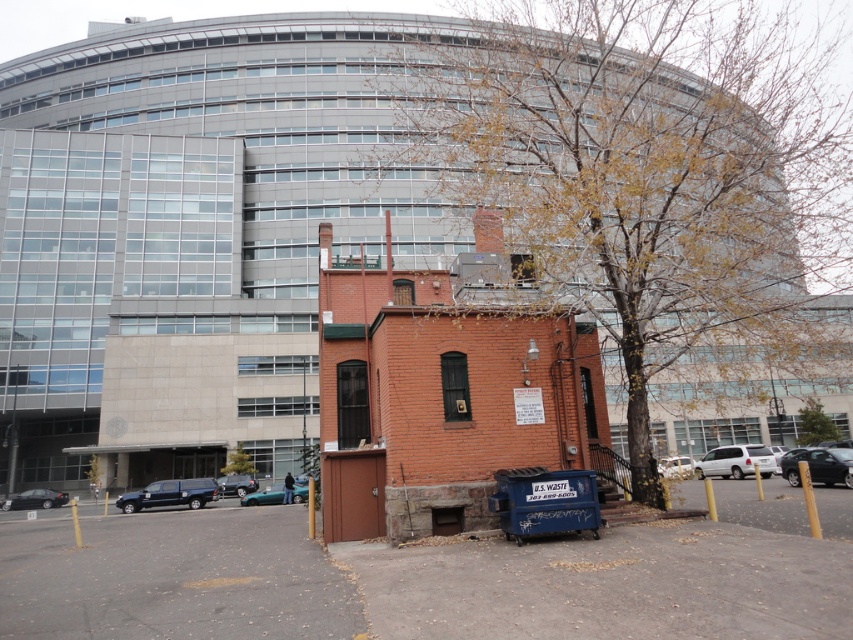
Question: Does white matte van at center lie behind shiny black sedan at center?

Choices:
 (A) yes
 (B) no

Answer: (B)

Question: Which object is the closest to the white matte van at center?

Choices:
 (A) silver metallic sedan at center
 (B) black metallic car at right
 (C) shiny black sedan at center
 (D) metallic blue truck at lower left

Answer: (A)

Question: Which object is positioned closest to the teal matte car at center?

Choices:
 (A) white matte van at center
 (B) metallic blue truck at lower left

Answer: (B)

Question: From the image, what is the correct spatial relationship of white matte van at center in relation to black metallic car at right?

Choices:
 (A) left
 (B) right

Answer: (B)

Question: Estimate the real-world distances between objects in this image. Which object is farther from the silver metallic sedan at center?

Choices:
 (A) metallic blue truck at lower left
 (B) shiny black sedan at center
 (C) white matte van at center

Answer: (B)

Question: Can you confirm if black metallic car at right is positioned to the left of silver metallic sedan at center?

Choices:
 (A) yes
 (B) no

Answer: (B)